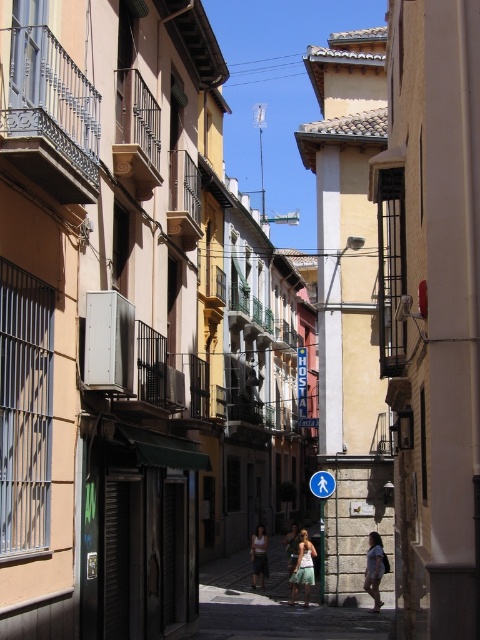
Is matte concrete alley at center behind green fabric skirt at center?

No, matte concrete alley at center is closer to the viewer.

Is point (215, 605) positioned in front of point (300, 563)?

That is True.

Does point (223, 557) come in front of point (302, 584)?

No.

You are a GUI agent. You are given a task and a screenshot of the screen. Output one action in this format:
    pyautogui.click(x=<x>, y=<y>)
    Task: Click on the matte concrete alley at center
    
    Given the screenshot: What is the action you would take?
    pyautogui.click(x=274, y=605)

Is point (264, 580) positioned behind point (323, 490)?

That is True.

From the picture: Can you confirm if white cotton tank top at center is taller than blue plastic pedestrian sign at center?

Indeed, white cotton tank top at center has a greater height compared to blue plastic pedestrian sign at center.

Measure the distance between point (256, 525) and camera.

The distance of point (256, 525) from camera is 185.52 feet.

Where is `white cotton tank top at center`? white cotton tank top at center is located at coordinates (259, 556).

Between point (311, 577) and point (319, 492), which one is positioned behind?

Point (319, 492)

Is green fabric skirt at center wider than blue plastic pedestrian sign at center?

Incorrect, green fabric skirt at center's width does not surpass blue plastic pedestrian sign at center's.

Find the location of `green fabric skirt at center`. green fabric skirt at center is located at coordinates (302, 568).